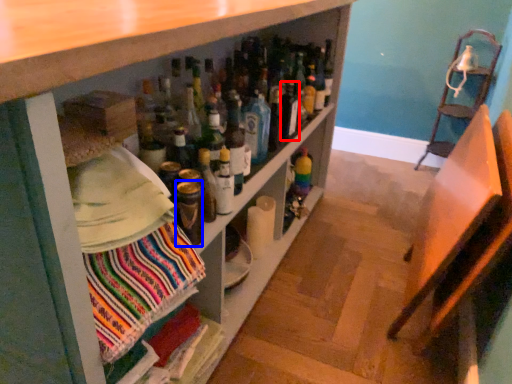
Question: Which object appears farthest to the camera in this image, bottle (highlighted by a red box) or bottle (highlighted by a blue box)?

Choices:
 (A) bottle
 (B) bottle

Answer: (A)